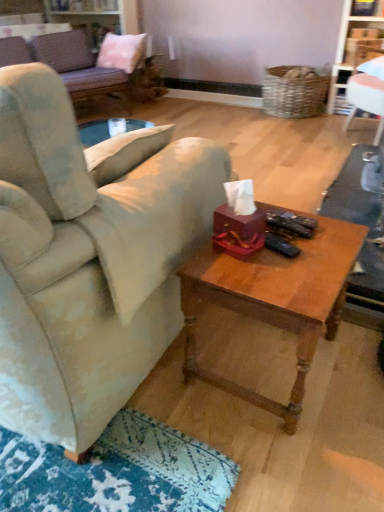
Question: Is white glossy bookshelf at upper right smaller than velvet beige couch at center, positioned as the 2th studio couch in back-to-front order?

Choices:
 (A) no
 (B) yes

Answer: (B)

Question: Considering the relative positions of white glossy bookshelf at upper right and velvet beige couch at center, which is the 1th studio couch in bottom-to-top order, in the image provided, is white glossy bookshelf at upper right behind velvet beige couch at center, which is the 1th studio couch in bottom-to-top order,?

Choices:
 (A) no
 (B) yes

Answer: (B)

Question: Does white glossy bookshelf at upper right lie in front of velvet beige couch at center, positioned as the 2th studio couch in back-to-front order?

Choices:
 (A) yes
 (B) no

Answer: (B)

Question: Considering the relative positions of white glossy bookshelf at upper right and velvet beige couch at center, which is the 1th studio couch in bottom-to-top order, in the image provided, is white glossy bookshelf at upper right to the left of velvet beige couch at center, which is the 1th studio couch in bottom-to-top order, from the viewer's perspective?

Choices:
 (A) no
 (B) yes

Answer: (A)

Question: Considering the relative positions of white glossy bookshelf at upper right and velvet beige couch at center, positioned as the 2th studio couch in back-to-front order, in the image provided, is white glossy bookshelf at upper right to the right of velvet beige couch at center, positioned as the 2th studio couch in back-to-front order, from the viewer's perspective?

Choices:
 (A) yes
 (B) no

Answer: (A)

Question: Considering the positions of pink fabric pillow at upper left and velvet purple studio couch at upper left, arranged as the second studio couch when ordered from the bottom, in the image, is pink fabric pillow at upper left taller or shorter than velvet purple studio couch at upper left, arranged as the second studio couch when ordered from the bottom,?

Choices:
 (A) tall
 (B) short

Answer: (B)

Question: Is point (125, 64) positioned closer to the camera than point (41, 53)?

Choices:
 (A) farther
 (B) closer

Answer: (A)

Question: In the image, is pink fabric pillow at upper left positioned in front of or behind velvet purple studio couch at upper left, arranged as the second studio couch when viewed from the front?

Choices:
 (A) front
 (B) behind

Answer: (B)

Question: From a real-world perspective, is pink fabric pillow at upper left positioned above or below velvet purple studio couch at upper left, arranged as the second studio couch when ordered from the bottom?

Choices:
 (A) above
 (B) below

Answer: (A)

Question: Based on their sizes in the image, would you say white glossy bookshelf at upper right is bigger or smaller than velvet purple studio couch at upper left, acting as the first studio couch starting from the back?

Choices:
 (A) small
 (B) big

Answer: (A)

Question: From the image's perspective, is white glossy bookshelf at upper right located above or below velvet purple studio couch at upper left, arranged as the second studio couch when viewed from the front?

Choices:
 (A) below
 (B) above

Answer: (A)

Question: Is point (347, 42) closer or farther from the camera than point (56, 68)?

Choices:
 (A) farther
 (B) closer

Answer: (B)

Question: In terms of width, does white glossy bookshelf at upper right look wider or thinner when compared to velvet purple studio couch at upper left, acting as the first studio couch starting from the back?

Choices:
 (A) wide
 (B) thin

Answer: (B)

Question: From the image's perspective, is velvet beige couch at center, the second studio couch when ordered from top to bottom, located above or below pink fabric pillow at upper left?

Choices:
 (A) above
 (B) below

Answer: (B)

Question: Considering the relative positions of velvet beige couch at center, positioned as the 2th studio couch in back-to-front order, and pink fabric pillow at upper left in the image provided, is velvet beige couch at center, positioned as the 2th studio couch in back-to-front order, to the left or to the right of pink fabric pillow at upper left?

Choices:
 (A) right
 (B) left

Answer: (B)